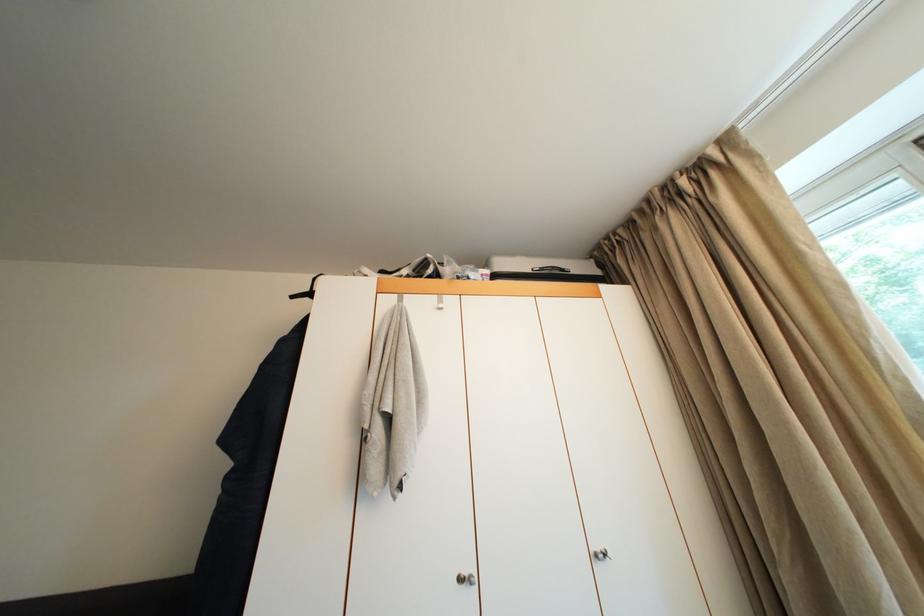
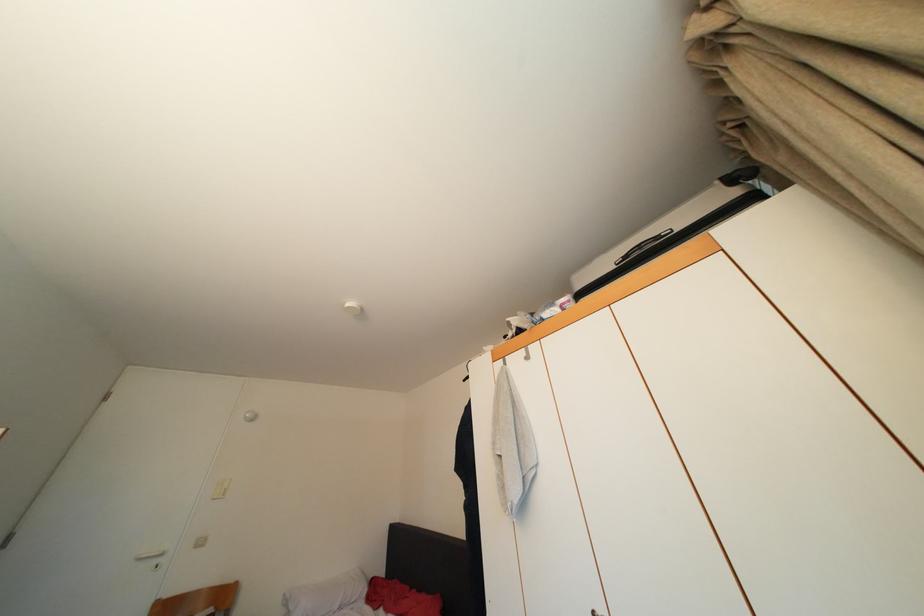
How did the camera likely rotate?

The camera rotated toward left-up.